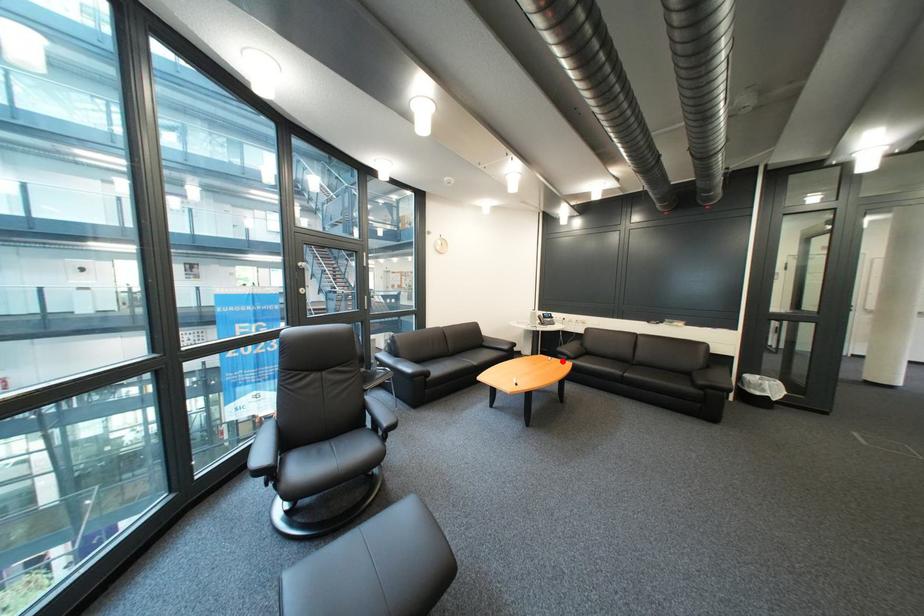
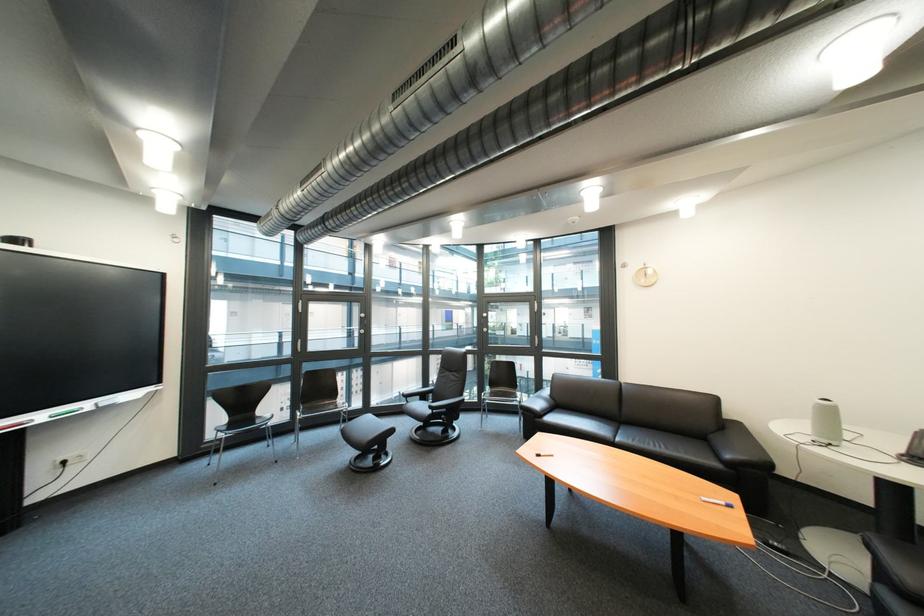
In the second image, find the point that corresponds to the highlighted location in the first image.

(718, 501)